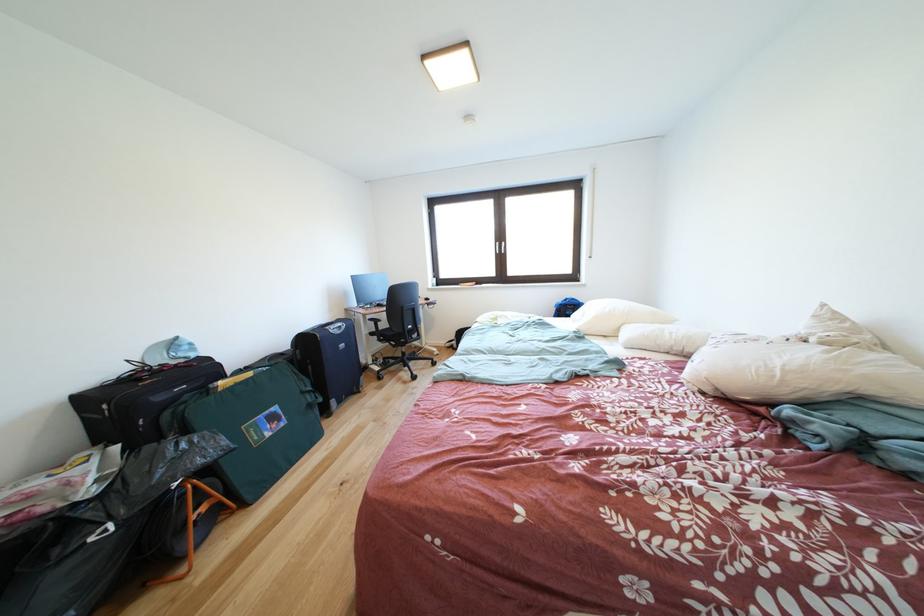
What do you see at coordinates (140, 400) in the screenshot? I see `a black suitcase handle` at bounding box center [140, 400].